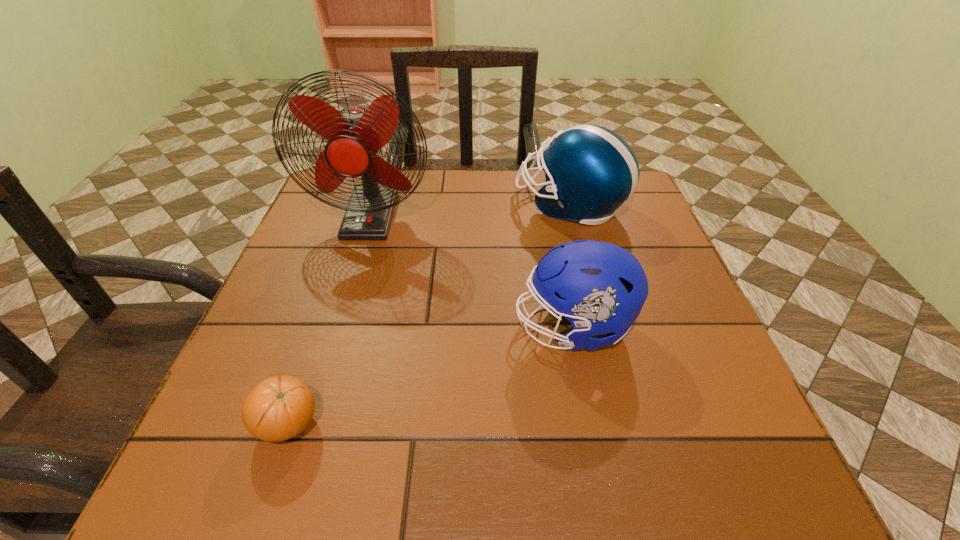
Locate an element on the screen. Image resolution: width=960 pixels, height=540 pixels. the tallest object is located at coordinates (355, 135).

This screenshot has width=960, height=540. I want to click on the farther football helmet, so click(590, 171).

Find the location of a particular element. This screenshot has width=960, height=540. the nearer football helmet is located at coordinates (600, 288).

I want to click on orange, so click(280, 407).

Identify the location of the nearest object. The image size is (960, 540). (280, 407).

Locate an element on the screen. free space located on the front-facing side of the fan is located at coordinates (325, 359).

Locate an element on the screen. free spot located 0.350m at the front of the farther football helmet with the faceguard is located at coordinates (377, 204).

Find the location of `vacant space located at the front of the farther football helmet with the faceguard`. vacant space located at the front of the farther football helmet with the faceguard is located at coordinates (472, 204).

Identify the location of free spot located at the front of the farther football helmet with the faceguard. The image size is (960, 540). (409, 204).

You are a GUI agent. You are given a task and a screenshot of the screen. Output one action in this format:
    pyautogui.click(x=<x>, y=<y>)
    Task: Click on the free space located 0.140m on the face guard of the nearer football helmet
    
    Given the screenshot: What is the action you would take?
    pyautogui.click(x=439, y=327)